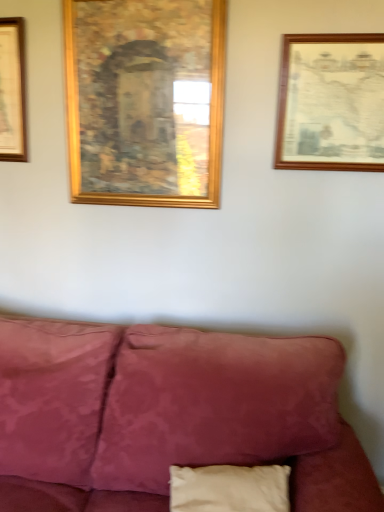
Question: From a real-world perspective, is gold wooden picture frame at upper center, the second picture frame in the right-to-left sequence, physically located above or below wooden picture frame at upper right, which is counted as the 2th picture frame, starting from the left?

Choices:
 (A) above
 (B) below

Answer: (A)

Question: Would you say gold wooden picture frame at upper center, which is the first picture frame in left-to-right order, is inside or outside wooden picture frame at upper right, which is the first picture frame from right to left?

Choices:
 (A) outside
 (B) inside

Answer: (A)

Question: In terms of size, does gold wooden picture frame at upper center, which is the first picture frame in left-to-right order, appear bigger or smaller than wooden picture frame at upper right, which is the first picture frame from right to left?

Choices:
 (A) big
 (B) small

Answer: (A)

Question: Based on their sizes in the image, would you say wooden picture frame at upper right, which is the first picture frame from right to left, is bigger or smaller than gold wooden picture frame at upper center, the second picture frame in the right-to-left sequence?

Choices:
 (A) big
 (B) small

Answer: (B)

Question: In the image, is wooden picture frame at upper right, which is the first picture frame from right to left, positioned in front of or behind gold wooden picture frame at upper center, the second picture frame in the right-to-left sequence?

Choices:
 (A) front
 (B) behind

Answer: (A)

Question: From a real-world perspective, is wooden picture frame at upper right, which is the first picture frame from right to left, positioned above or below gold wooden picture frame at upper center, the second picture frame in the right-to-left sequence?

Choices:
 (A) above
 (B) below

Answer: (B)

Question: Is point (359, 98) closer or farther from the camera than point (208, 163)?

Choices:
 (A) closer
 (B) farther

Answer: (A)